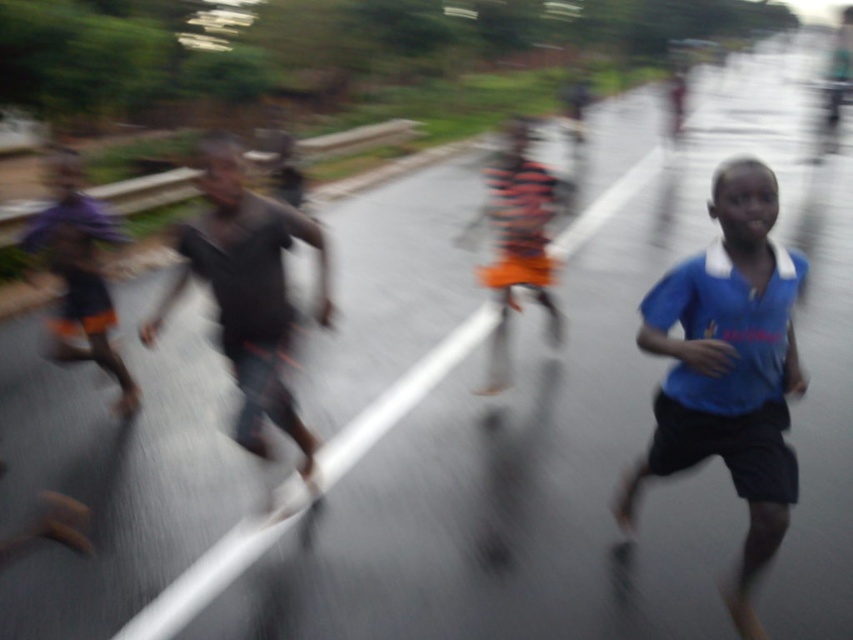
You are a photographer trying to capture a clear shot of the blue fabric shirt at right and the dark gray fabric pants at left. Which object should you focus on first to ensure it appears sharp in the photo?

The blue fabric shirt at right is closer to the viewer than the dark gray fabric pants at left, so you should focus on the blue fabric shirt at right first to ensure it appears sharp.

You are a photographer trying to capture a clear image of the blue fabric shirt at right. The camera is focused at point (x=729, y=369). Is the point on the blue fabric shirt at right?

Yes, the point (x=729, y=369) is on the blue fabric shirt at right according to the description.